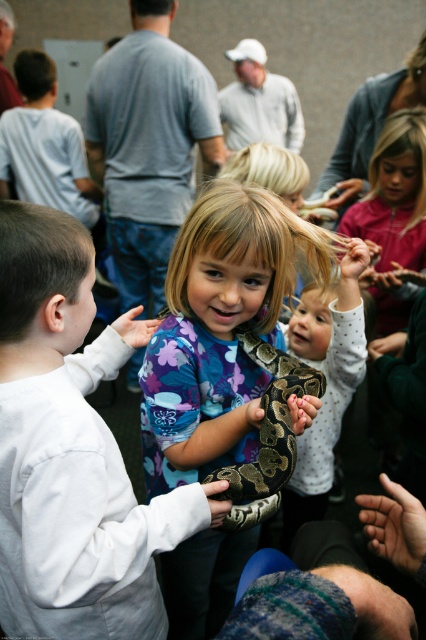
You are a photographer at the event and want to take a photo of the girl and the snake. Since the white soft shirt at center is in front of the patterned dark green snake at center, will the snake be visible in the photo?

The white soft shirt at center is in front of the patterned dark green snake at center, so the snake may be partially or fully obscured depending on the shirt material. If the shirt is opaque, the snake might not be visible. If it is sheer, some parts could show through.